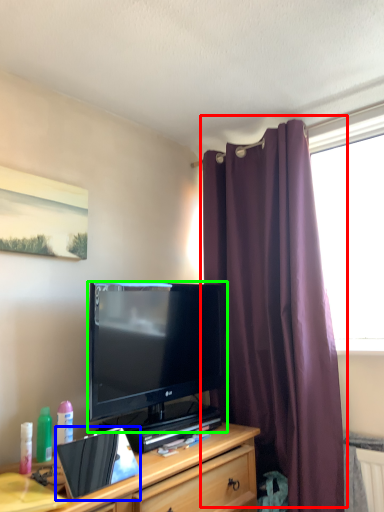
Question: Which object is positioned farthest from curtain (highlighted by a red box)? Select from laptop (highlighted by a blue box) and television (highlighted by a green box).

Choices:
 (A) laptop
 (B) television

Answer: (A)